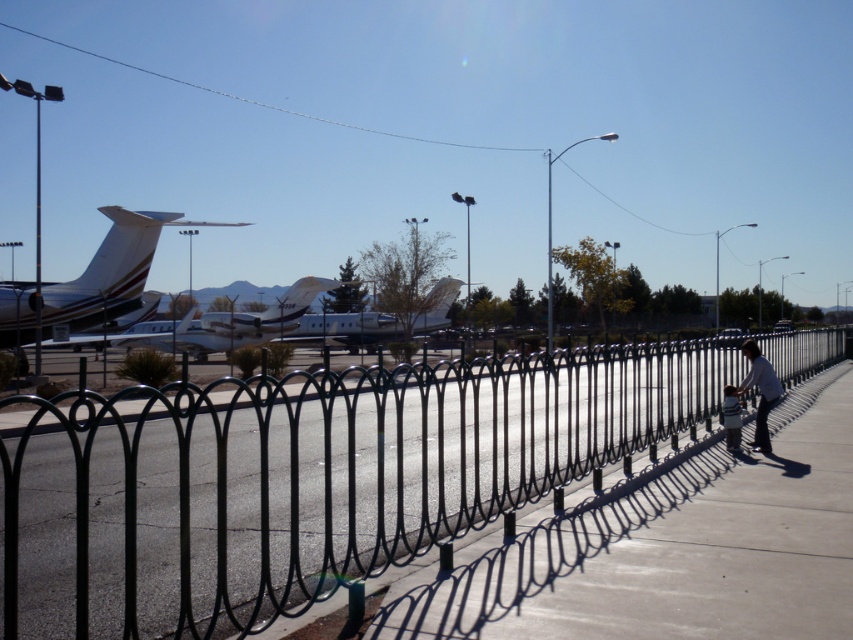
You are a maintenance worker who needs to inspect both the white glossy airplane at left and the white glossy airplane at center. Given that your inspection equipment has a 10 meter range, can you use it to check both airplanes from a single position without moving?

The white glossy airplane at left and white glossy airplane at center are 10.32 meters apart, which exceeds the 10 meter range of the inspection equipment. Therefore, you cannot check both airplanes from a single position without moving.

You are a photographer positioned at the airport. You want to take a photo that includes both the black wrought iron fence at center and the light blue shirt at right. Which object should you adjust your camera focus to first to ensure both are in the frame?

Since the black wrought iron fence at center is closer to the viewer than the light blue shirt at right, you should focus on the black wrought iron fence at center first to ensure both are in the frame.

You are a photographer standing at the fence. You want to capture a photo of the white glossy airplane at left and the white fabric shirt at lower right in the same frame. Which object should you focus on first to ensure both are in the shot?

You should focus on the white glossy airplane at left first because it is wider than the white fabric shirt at lower right, so centering it will help include both in the frame.